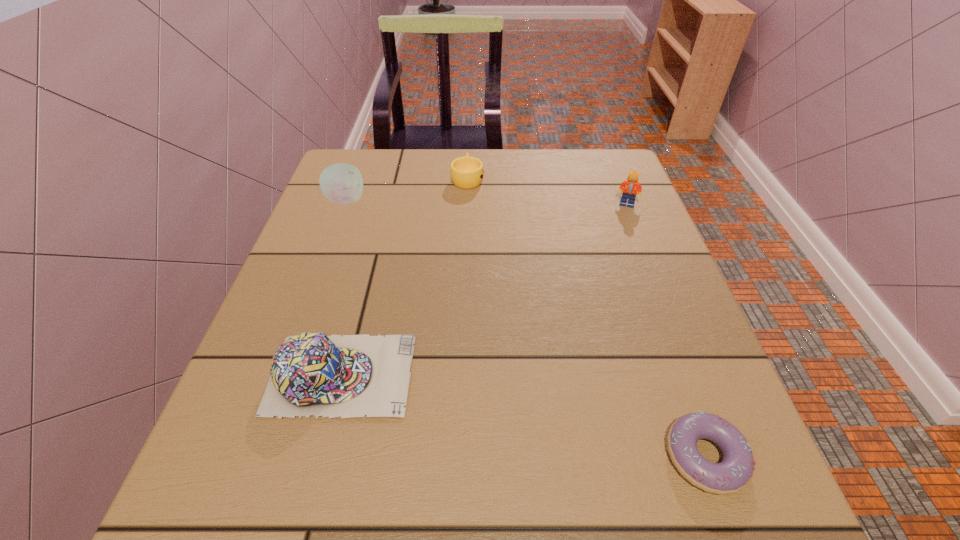
Locate an element on the screen. The width and height of the screenshot is (960, 540). vacant space at the far edge is located at coordinates (564, 194).

I want to click on free location at the near edge of the desktop, so click(647, 492).

In the image, there is a desktop. Identify the location of vacant space at the left edge. (282, 318).

Locate an element on the screen. The width and height of the screenshot is (960, 540). vacant space at the right edge of the desktop is located at coordinates (616, 253).

The height and width of the screenshot is (540, 960). What are the coordinates of `free space at the far right corner of the desktop` in the screenshot? It's located at (578, 171).

Identify the location of free region at the near right corner. The image size is (960, 540). (660, 503).

Locate an element on the screen. free spot between the third tallest object and the shortest object is located at coordinates (523, 416).

I want to click on vacant space in between the cap and the cup, so click(404, 276).

At what (x,y) coordinates should I click in order to perform the action: click on vacant space that's between the shortest object and the cup. Please return your answer as a coordinate pair (x, y). Image resolution: width=960 pixels, height=540 pixels. Looking at the image, I should click on tap(587, 318).

At what (x,y) coordinates should I click in order to perform the action: click on empty space between the cap and the third object from left to right. Please return your answer as a coordinate pair (x, y). This screenshot has width=960, height=540. Looking at the image, I should click on (404, 276).